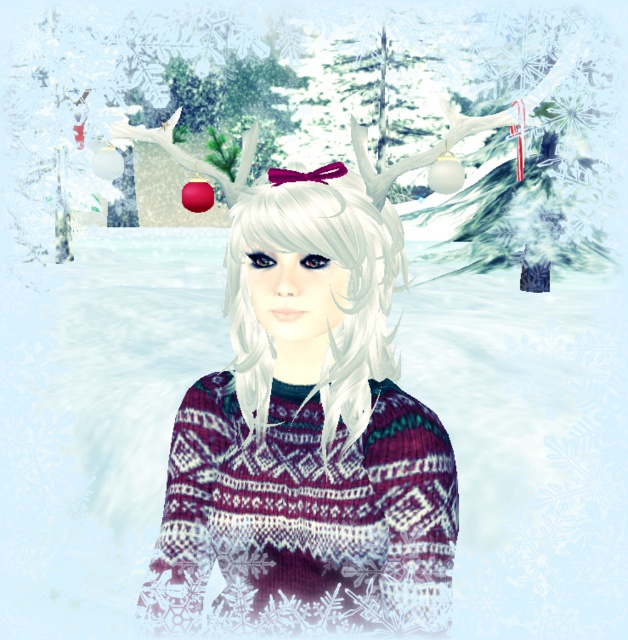
Question: Which point appears closest to the camera in this image?

Choices:
 (A) (330, 387)
 (B) (354, 608)

Answer: (A)

Question: Which object is closer to the camera taking this photo?

Choices:
 (A) white matte hair at center
 (B) knitted sweater at center
 (C) knitted wool sweater at center

Answer: (A)

Question: Can you confirm if knitted sweater at center is smaller than knitted wool sweater at center?

Choices:
 (A) no
 (B) yes

Answer: (A)

Question: Can you confirm if knitted wool sweater at center is positioned to the right of white matte hair at center?

Choices:
 (A) no
 (B) yes

Answer: (A)

Question: Which point is closer to the camera?

Choices:
 (A) knitted sweater at center
 (B) white matte hair at center

Answer: (B)

Question: Is knitted wool sweater at center positioned in front of white matte hair at center?

Choices:
 (A) no
 (B) yes

Answer: (A)